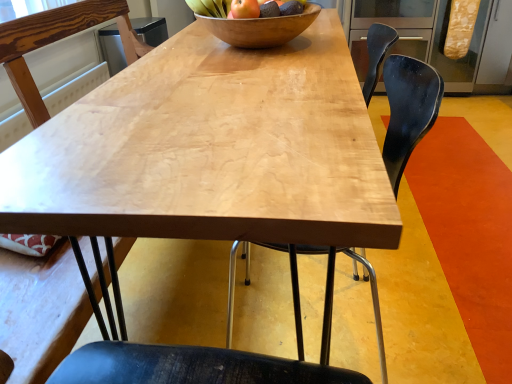
Locate an element on the screen. free space to the left of black plastic chair at center, which is counted as the third chair, starting from the left is located at coordinates (183, 297).